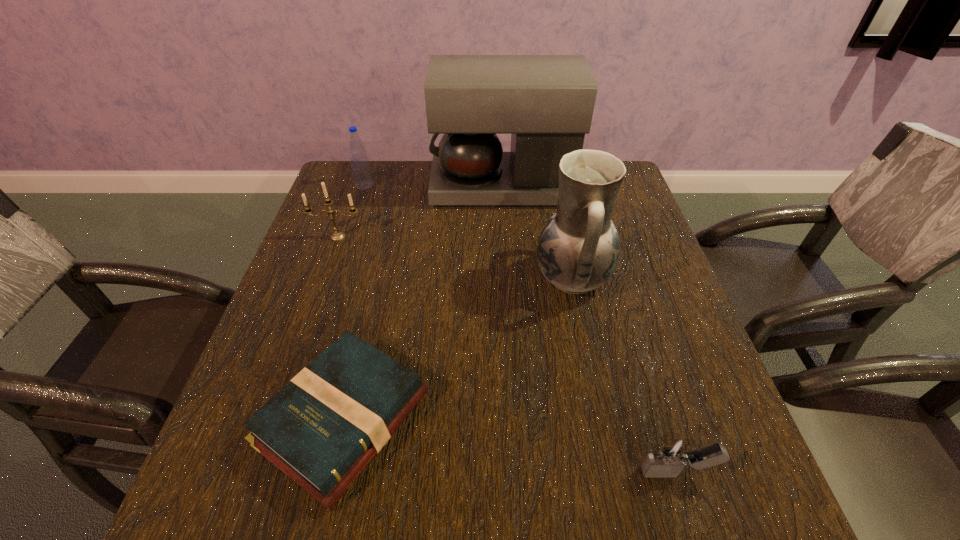
Locate an element on the screen. This screenshot has height=540, width=960. water bottle situated at the left edge is located at coordinates (361, 170).

The height and width of the screenshot is (540, 960). Identify the location of candle that is at the left edge. (337, 235).

Image resolution: width=960 pixels, height=540 pixels. What are the coordinates of `hardback book that is positioned at the left edge` in the screenshot? It's located at pyautogui.click(x=322, y=429).

This screenshot has height=540, width=960. Identify the location of pitcher situated at the right edge. (578, 249).

The image size is (960, 540). Find the location of `igniter at the right edge`. igniter at the right edge is located at coordinates (673, 452).

What are the coordinates of `object that is at the far left corner` in the screenshot? It's located at (x=361, y=170).

Image resolution: width=960 pixels, height=540 pixels. Find the location of `object at the near left corner`. object at the near left corner is located at coordinates (x=322, y=429).

Locate an element on the screen. object that is at the near right corner is located at coordinates (673, 452).

This screenshot has width=960, height=540. I want to click on free space at the far edge of the desktop, so click(484, 205).

This screenshot has width=960, height=540. In the image, there is a desktop. What are the coordinates of `vacant space at the near edge` in the screenshot? It's located at (463, 518).